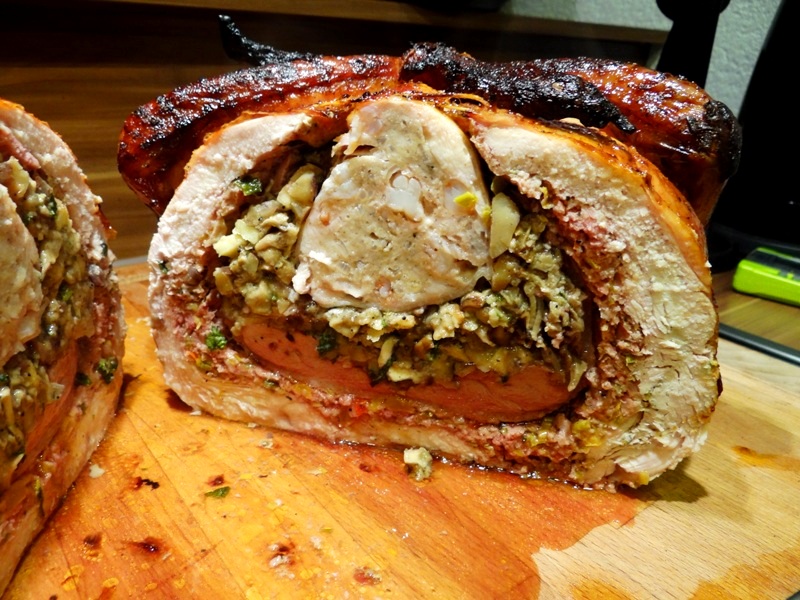
You are a GUI agent. You are given a task and a screenshot of the screen. Output one action in this format:
    pyautogui.click(x=<x>, y=<y>)
    Task: Click on the wet part of wooden surface
    The image size is (800, 600).
    Given the screenshot: What is the action you would take?
    pyautogui.click(x=230, y=537)